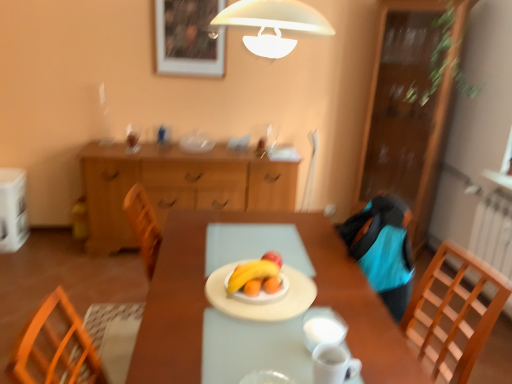
Identify the location of vacant space in front of yellow matte banana at center. [251, 328].